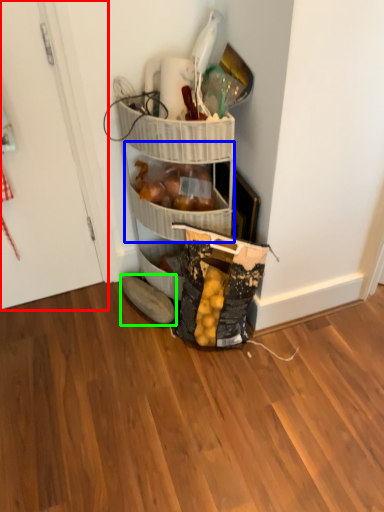
Question: Which object is the closest to the door (highlighted by a red box)? Choose among these: basket (highlighted by a blue box) or footwear (highlighted by a green box).

Choices:
 (A) basket
 (B) footwear

Answer: (A)